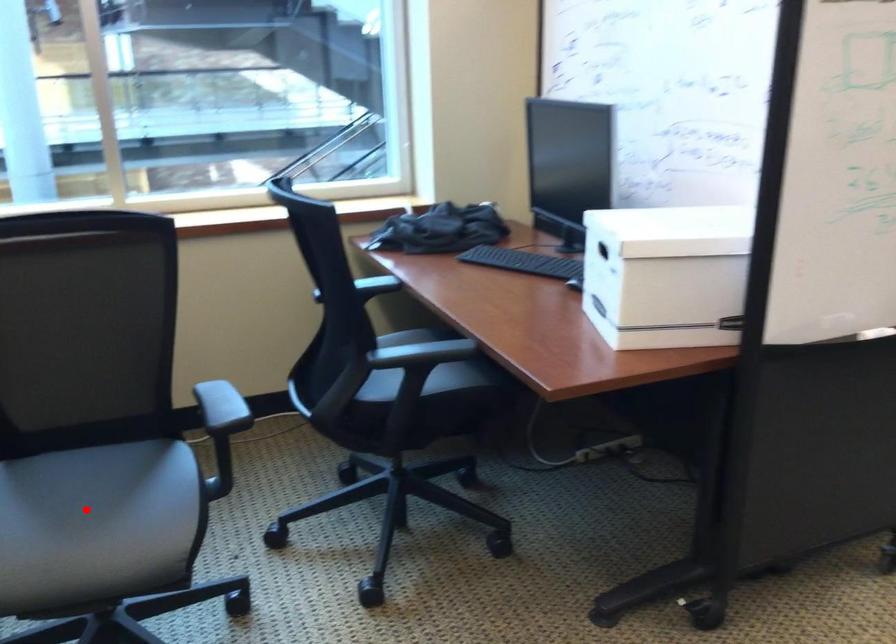
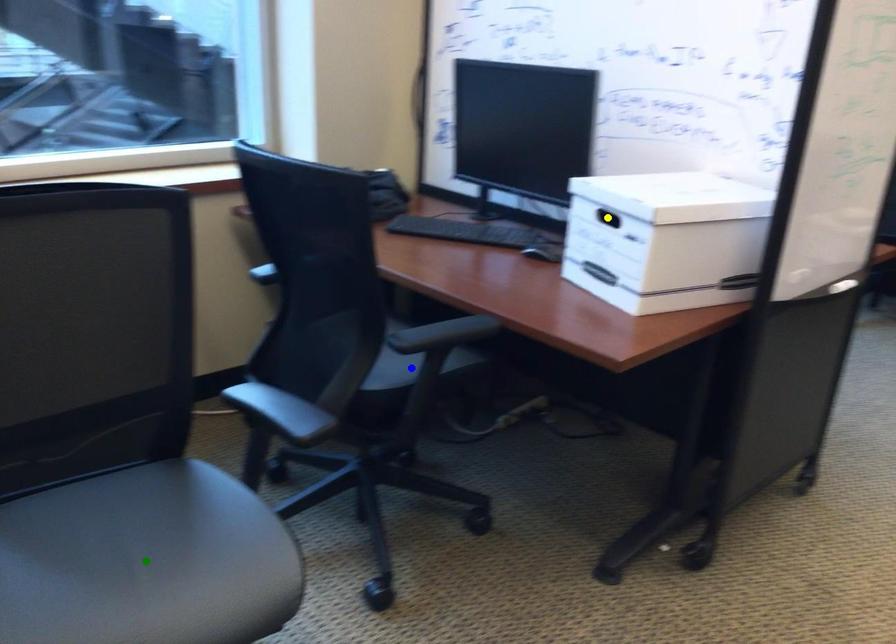
Question: I am providing you with two images of the same scene from different viewpoints. A red point is marked on the first image. You are given multiple points on the second image. Which point in image 2 is actually the same real-world point as the red point in image 1?

Choices:
 (A) green point
 (B) blue point
 (C) yellow point

Answer: (A)